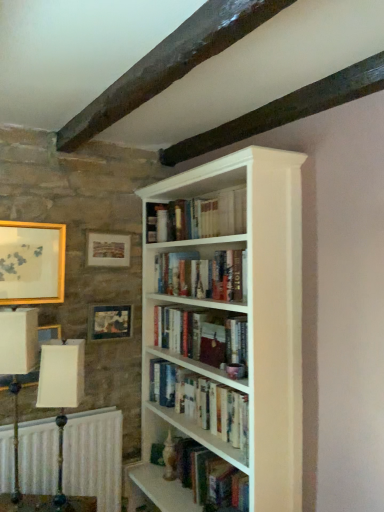
Question: From a real-world perspective, is white painted wood bookcase at center on top of matte gold picture frame at upper left, positioned as the second picture frame in right-to-left order?

Choices:
 (A) no
 (B) yes

Answer: (A)

Question: Is white painted wood bookcase at center at the right side of matte gold picture frame at upper left, positioned as the second picture frame in right-to-left order?

Choices:
 (A) yes
 (B) no

Answer: (A)

Question: From the image's perspective, is white painted wood bookcase at center located beneath matte gold picture frame at upper left, positioned as the second picture frame in right-to-left order?

Choices:
 (A) yes
 (B) no

Answer: (A)

Question: Considering the relative sizes of white painted wood bookcase at center and matte gold picture frame at upper left, placed as the second picture frame when sorted from left to right, in the image provided, is white painted wood bookcase at center shorter than matte gold picture frame at upper left, placed as the second picture frame when sorted from left to right,?

Choices:
 (A) no
 (B) yes

Answer: (A)

Question: Is white painted wood bookcase at center not within matte gold picture frame at upper left, placed as the second picture frame when sorted from left to right?

Choices:
 (A) no
 (B) yes

Answer: (B)

Question: Which is correct: hardcover books at center, marked as the fourth book in a bottom-to-top arrangement, is inside hardcover books at center, marked as the fourth book in a top-to-bottom arrangement, or outside of it?

Choices:
 (A) inside
 (B) outside

Answer: (B)

Question: In the image, is hardcover books at center, marked as the fourth book in a bottom-to-top arrangement, positioned in front of or behind hardcover books at center, which is the 1th book in bottom-to-top order?

Choices:
 (A) behind
 (B) front

Answer: (A)

Question: Looking at the image, does hardcover books at center, acting as the first book starting from the top, seem bigger or smaller compared to hardcover books at center, marked as the fourth book in a top-to-bottom arrangement?

Choices:
 (A) small
 (B) big

Answer: (A)

Question: Considering the positions of hardcover books at center, acting as the first book starting from the top, and hardcover books at center, which is the 1th book in bottom-to-top order, in the image, is hardcover books at center, acting as the first book starting from the top, wider or thinner than hardcover books at center, which is the 1th book in bottom-to-top order,?

Choices:
 (A) thin
 (B) wide

Answer: (A)

Question: Considering the positions of point [x=238, y=275] and point [x=223, y=364], is point [x=238, y=275] closer or farther from the camera than point [x=223, y=364]?

Choices:
 (A) closer
 (B) farther

Answer: (A)

Question: From the image's perspective, relative to hardcover book at center, which is the third book from top to bottom, is white painted wood bookcase at center above or below?

Choices:
 (A) above
 (B) below

Answer: (B)

Question: From a real-world perspective, relative to hardcover book at center, which is the third book from top to bottom, is white painted wood bookcase at center vertically above or below?

Choices:
 (A) above
 (B) below

Answer: (B)

Question: Would you say white painted wood bookcase at center is inside or outside hardcover book at center, which is the third book from top to bottom?

Choices:
 (A) outside
 (B) inside

Answer: (A)

Question: Is point (39, 400) closer or farther from the camera than point (170, 408)?

Choices:
 (A) closer
 (B) farther

Answer: (A)

Question: From a real-world perspective, relative to white wood bookshelf at center, is white fabric lampshade at left, the 1th table lamp positioned from the right, vertically above or below?

Choices:
 (A) below
 (B) above

Answer: (B)